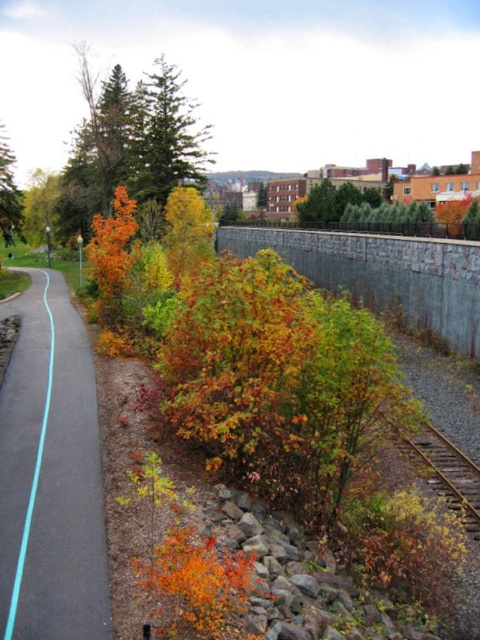
Between point (81, 577) and point (14, 211), which one is positioned in front?

Point (81, 577) is more forward.

Is blue asphalt path at center wider than orange leafy bush at left?

In fact, blue asphalt path at center might be narrower than orange leafy bush at left.

This screenshot has width=480, height=640. I want to click on blue asphalt path at center, so click(50, 476).

In the scene shown: Does blue asphalt path at center have a lesser height compared to green matte tree at upper center?

Yes.

Where is `blue asphalt path at center`? Image resolution: width=480 pixels, height=640 pixels. blue asphalt path at center is located at coordinates (50, 476).

Is green matte tree at upper center bigger than orange leafy bush at left?

Actually, green matte tree at upper center might be smaller than orange leafy bush at left.

Is the position of green matte tree at upper center less distant than that of orange leafy bush at left?

No, it is behind orange leafy bush at left.

Is point (144, 147) closer to viewer compared to point (1, 198)?

That is False.

Where is `green matte tree at upper center`? This screenshot has height=640, width=480. green matte tree at upper center is located at coordinates (165, 136).